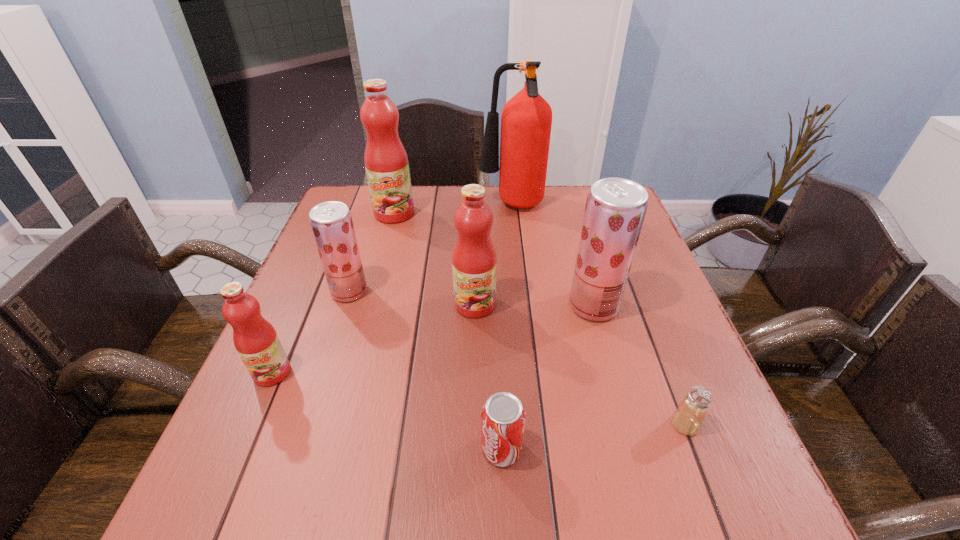
Locate an element on the screen. The image size is (960, 540). the seventh tallest object is located at coordinates click(503, 416).

This screenshot has width=960, height=540. I want to click on the shortest object, so click(688, 418).

The image size is (960, 540). I want to click on the rightmost object, so click(x=688, y=418).

The width and height of the screenshot is (960, 540). I want to click on free space located 0.320m at the nozzle of the red fire extinguisher, so click(372, 206).

Find the location of a particular element. vacant space positioned 0.320m at the nozzle of the red fire extinguisher is located at coordinates (372, 206).

Identify the location of vacant point located at the nozzle of the red fire extinguisher. Image resolution: width=960 pixels, height=540 pixels. (349, 206).

Identify the location of free location located 0.400m on the front label of the second pink fruit juice from left to right. This screenshot has height=540, width=960. (363, 329).

Identify the location of vacant space located on the front label of the second biggest pink fruit juice. (472, 482).

The image size is (960, 540). Identify the location of vacant point located 0.230m on the back of the bigger strawberry fruit juice. (573, 233).

Identify the location of free location located on the back of the smaller strawberry fruit juice. Image resolution: width=960 pixels, height=540 pixels. (371, 226).